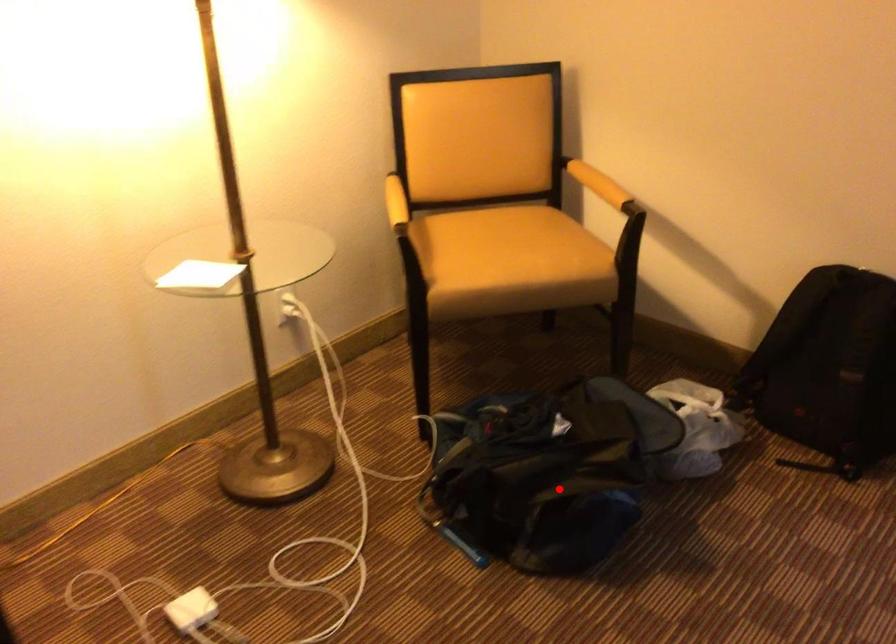
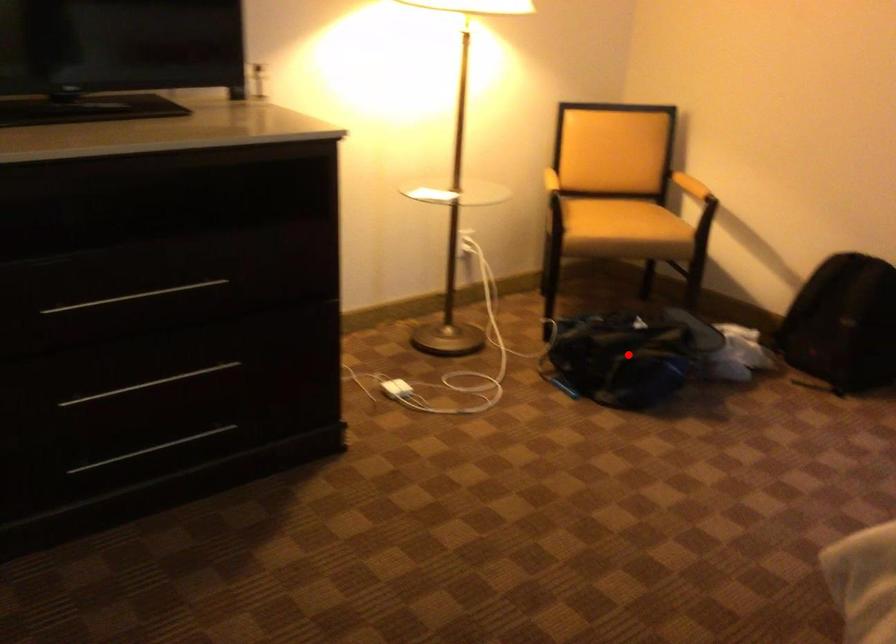
I am providing you with two images of the same scene from different viewpoints. A red point is marked on the first image and another point is marked on the second image. Is the red point in image1 aligned with the point shown in image2?

Yes